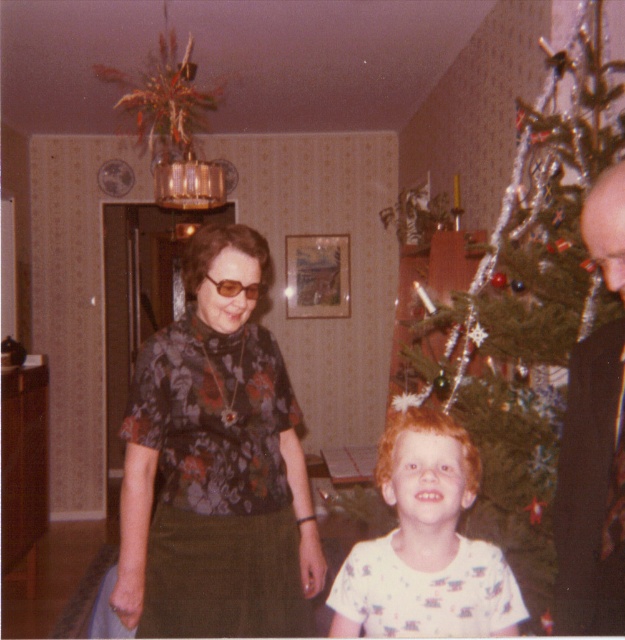
You are a photographer setting up for a family photo in the living room. You need to ensure that the floral print blouse at center and the white cotton shirt at center are visible in the frame. Given that your camera has a focus range of 15 inches, will you be able to capture both items clearly?

The floral print blouse at center is 17.89 inches away from the white cotton shirt at center. Since the distance between them exceeds the camera focus range of 15 inches, the camera may not be able to capture both items clearly in focus simultaneously.

You are a guest at the holiday gathering and want to place a gift box on the floor between the green textured christmas tree at right and the dark brown leather jacket at right. Based on their widths, can you determine if there will be enough space for the gift box?

The green textured christmas tree at right might be wider than dark brown leather jacket at right, so there may not be enough space between them for the gift box.